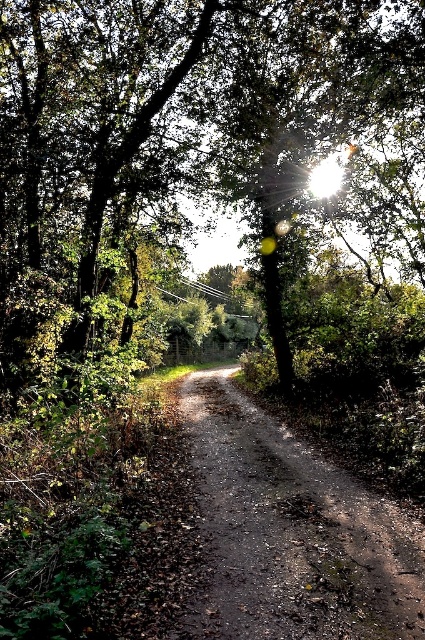
You are standing on the dirt path in the wooded area and see two points marked in the scene. Which point, point (79,230) or point (365,632), is closer to you?

Point (79,230) is closer to you because it is further to the viewer than point (365,632).

From the picture: You are a hiker walking along the path and want to take a photo of the green leafy tree at center and the dusty brown dirt track at center. Which object should you focus on if you want both to be in sharp focus, considering their sizes?

The green leafy tree at center is bigger than the dusty brown dirt track at center, so focusing on the larger object, the green leafy tree at center, would help ensure both are in sharp focus.

You are a hiker walking along the path in the image. You want to take a photo of the green leafy tree at center and the dusty brown dirt track at center. Which object will appear wider in the photo?

The green leafy tree at center will appear wider in the photo because its width is larger than the dusty brown dirt track at center.